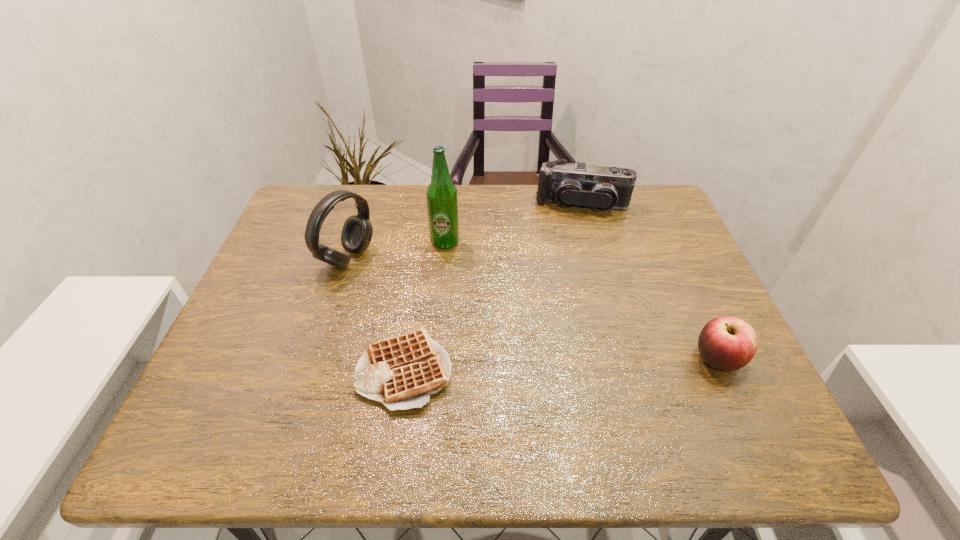
Where is `apple present at the near edge`? apple present at the near edge is located at coordinates (726, 343).

Where is `object present at the left edge`? object present at the left edge is located at coordinates (357, 231).

The height and width of the screenshot is (540, 960). Find the location of `apple located at the right edge`. apple located at the right edge is located at coordinates (726, 343).

Where is `camcorder that is at the right edge`? Image resolution: width=960 pixels, height=540 pixels. camcorder that is at the right edge is located at coordinates (602, 188).

At what (x,y) coordinates should I click in order to perform the action: click on object that is at the far right corner. Please return your answer as a coordinate pair (x, y). Image resolution: width=960 pixels, height=540 pixels. Looking at the image, I should click on (602, 188).

Where is `object that is positioned at the near right corner`? This screenshot has height=540, width=960. object that is positioned at the near right corner is located at coordinates pyautogui.click(x=726, y=343).

Where is `free spot at the far edge of the desktop`? free spot at the far edge of the desktop is located at coordinates (468, 204).

This screenshot has height=540, width=960. Find the location of `vacant space at the near edge`. vacant space at the near edge is located at coordinates (591, 400).

Locate an element on the screen. free space at the left edge is located at coordinates (272, 313).

In the image, there is a desktop. Where is `vacant space at the right edge`? The image size is (960, 540). vacant space at the right edge is located at coordinates (677, 258).